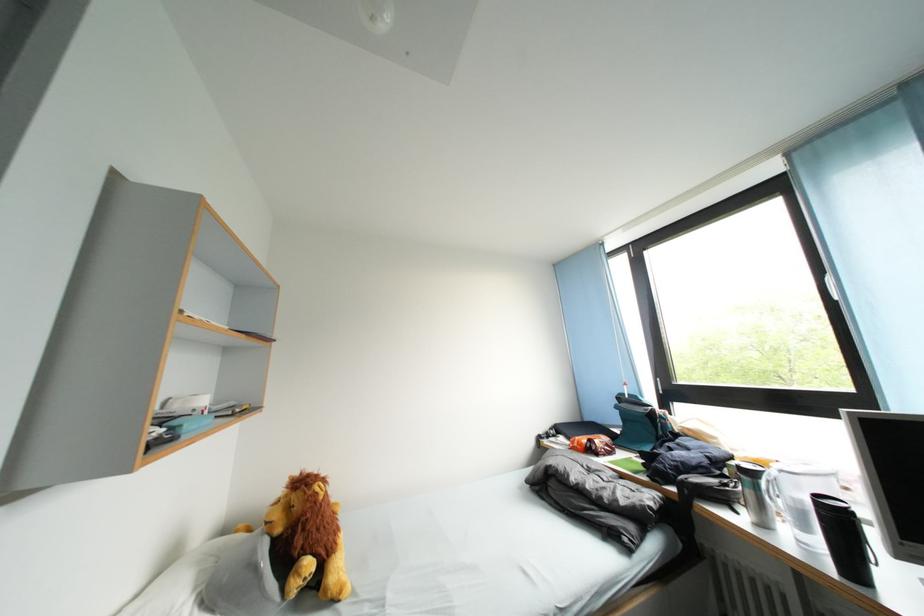
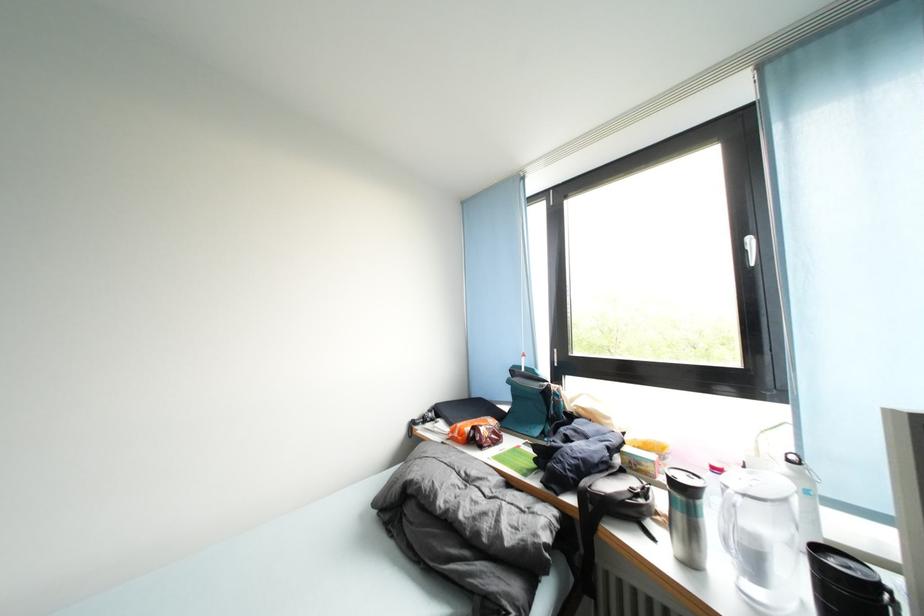
Find the pixel in the second image that matches pixel 600 455 in the first image.

(482, 446)